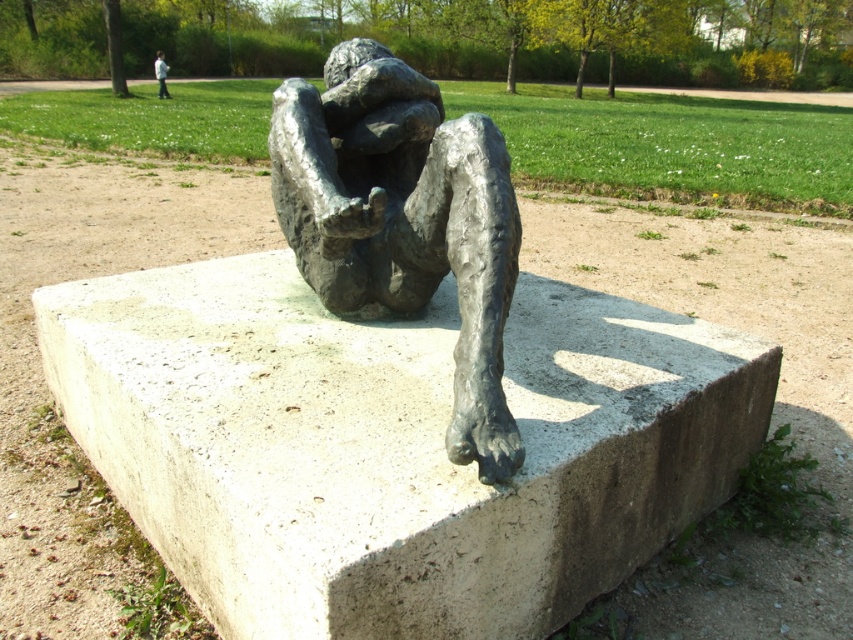
Question: Does smooth concrete base at center have a lesser width compared to bronze sculpture at center?

Choices:
 (A) yes
 (B) no

Answer: (B)

Question: Which point is farther to the camera?

Choices:
 (A) 161,84
 (B) 453,244

Answer: (A)

Question: Considering the real-world distances, which object is farthest from the smooth concrete base at center?

Choices:
 (A) bronze sculpture at center
 (B) white cotton shirt at upper center

Answer: (B)

Question: Which object appears closest to the camera in this image?

Choices:
 (A) bronze sculpture at center
 (B) smooth concrete base at center
 (C) white cotton shirt at upper center

Answer: (B)

Question: Can you confirm if smooth concrete base at center is wider than bronze sculpture at center?

Choices:
 (A) yes
 (B) no

Answer: (A)

Question: In this image, where is smooth concrete base at center located relative to white cotton shirt at upper center?

Choices:
 (A) left
 (B) right

Answer: (B)